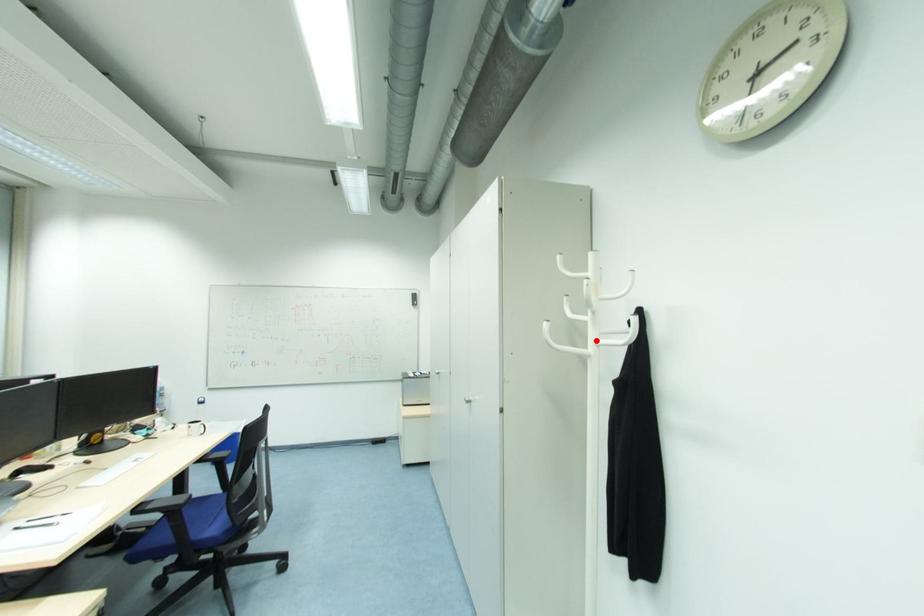
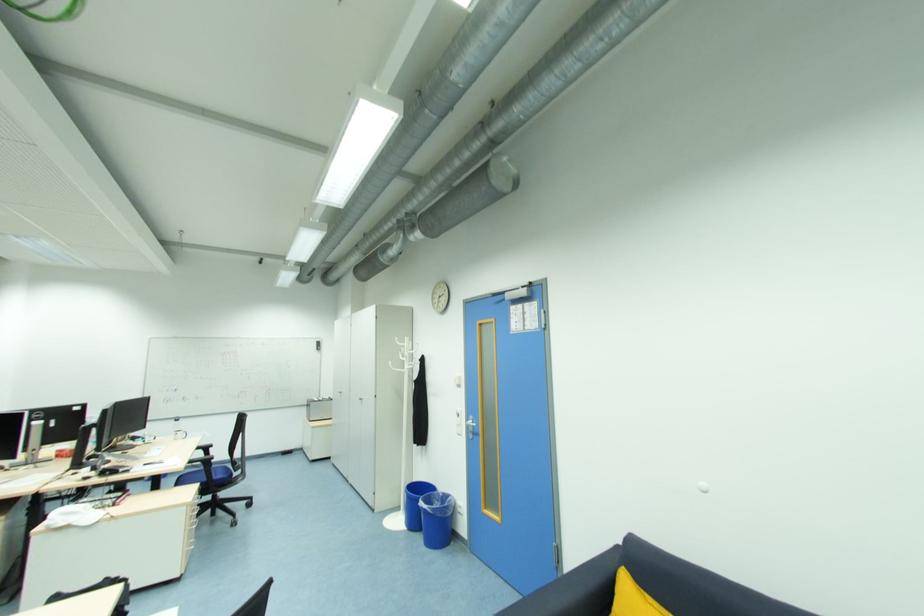
The point at the highlighted location is marked in the first image. Where is the corresponding point in the second image?

(409, 368)